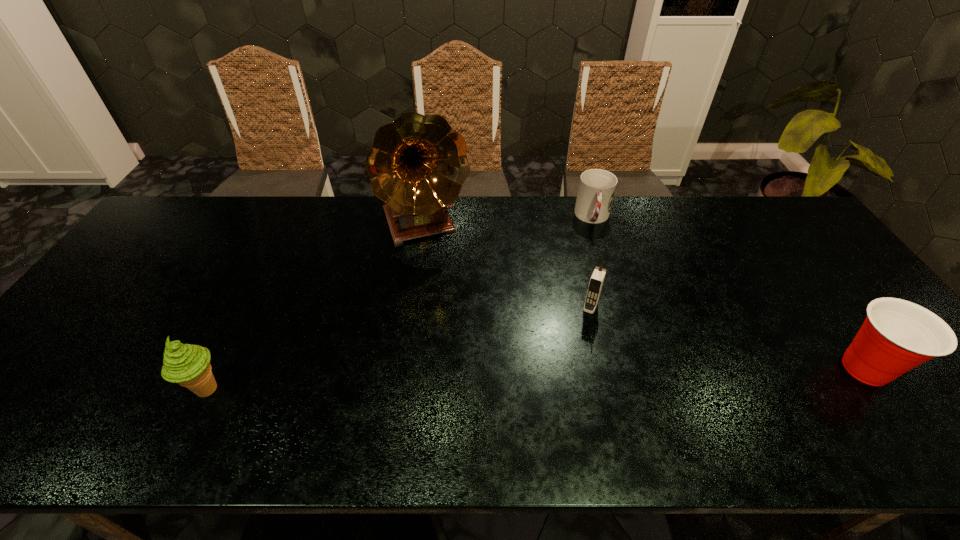
I want to click on phonograph_record present at the far edge, so click(417, 165).

Where is `icecream situated at the near edge`? icecream situated at the near edge is located at coordinates (188, 365).

Locate an element on the screen. Image resolution: width=960 pixels, height=540 pixels. cup positioned at the near edge is located at coordinates (897, 335).

Identify the location of object present at the right edge. Image resolution: width=960 pixels, height=540 pixels. (897, 335).

I want to click on object that is at the near right corner, so (897, 335).

This screenshot has height=540, width=960. Identify the location of free point at the far edge. (x=684, y=213).

In the image, there is a desktop. Identify the location of blank space at the near edge. This screenshot has height=540, width=960. [315, 392].

Image resolution: width=960 pixels, height=540 pixels. In the image, there is a desktop. What are the coordinates of `free space at the left edge` in the screenshot? It's located at (114, 301).

In the image, there is a desktop. Where is `free space at the right edge`? Image resolution: width=960 pixels, height=540 pixels. free space at the right edge is located at coordinates (831, 318).

This screenshot has height=540, width=960. In the image, there is a desktop. What are the coordinates of `blank space at the far left corner` in the screenshot? It's located at (191, 228).